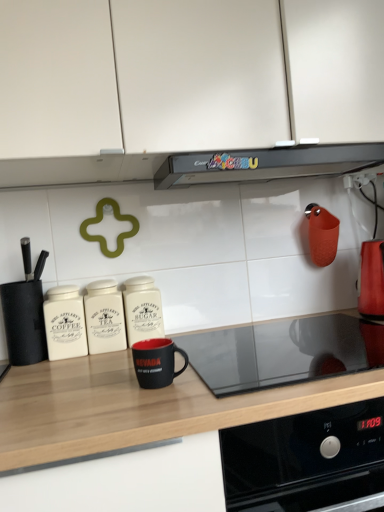
The width and height of the screenshot is (384, 512). Identify the location of spots to the right of black matte mug at center, placed as the 4th kitchen appliance when sorted from left to right. (224, 395).